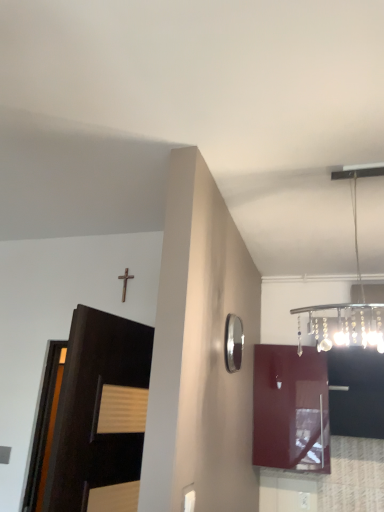
What is the approximate height of metallic chandelier at upper right?

The height of metallic chandelier at upper right is 75.75 centimeters.

You are a GUI agent. You are given a task and a screenshot of the screen. Output one action in this format:
    pyautogui.click(x=<x>, y=<y>)
    Task: Click on the metallic chandelier at upper right
    This screenshot has width=384, height=512.
    Given the screenshot: What is the action you would take?
    pyautogui.click(x=348, y=303)

Describe the element at coordinates (93, 410) in the screenshot. I see `dark wood door at left` at that location.

I want to click on dark wood door at left, so click(93, 410).

Where is `silver/metallic mirror at upper right`? This screenshot has height=512, width=384. silver/metallic mirror at upper right is located at coordinates (233, 343).

Locate an element on the screen. black glossy cabinet at upper right, marked as the first cabinetry in a right-to-left arrangement is located at coordinates (356, 392).

Find the location of a particular element. metallic chandelier at upper right is located at coordinates (348, 303).

Between metallic chandelier at upper right and black glossy cabinet at upper right, marked as the first cabinetry in a right-to-left arrangement, which one has less height?

Standing shorter between the two is black glossy cabinet at upper right, marked as the first cabinetry in a right-to-left arrangement.

From the image's perspective, is metallic chandelier at upper right over black glossy cabinet at upper right, marked as the second cabinetry in a left-to-right arrangement?

Yes, from the image's perspective, metallic chandelier at upper right is over black glossy cabinet at upper right, marked as the second cabinetry in a left-to-right arrangement.

Is metallic chandelier at upper right next to black glossy cabinet at upper right, marked as the second cabinetry in a left-to-right arrangement, and touching it?

No, metallic chandelier at upper right is not making contact with black glossy cabinet at upper right, marked as the second cabinetry in a left-to-right arrangement.

From a real-world perspective, which object stands above the other?

metallic chandelier at upper right.

Is glossy burgundy cabinet at right, which ranks as the 2th cabinetry in right-to-left order, positioned with its back to dark wood door at left?

glossy burgundy cabinet at right, which ranks as the 2th cabinetry in right-to-left order, is not turned away from dark wood door at left.

From the image's perspective, between glossy burgundy cabinet at right, the first cabinetry positioned from the left, and dark wood door at left, which one is located above?

dark wood door at left, from the image's perspective.

Can you tell me how much glossy burgundy cabinet at right, which ranks as the 2th cabinetry in right-to-left order, and dark wood door at left differ in facing direction?

glossy burgundy cabinet at right, which ranks as the 2th cabinetry in right-to-left order, and dark wood door at left are facing 100 degrees away from each other.

Is black glossy cabinet at upper right, marked as the second cabinetry in a left-to-right arrangement, surrounded by dark wood door at left?

No, black glossy cabinet at upper right, marked as the second cabinetry in a left-to-right arrangement, is located outside of dark wood door at left.

Considering the relative positions of dark wood door at left and black glossy cabinet at upper right, marked as the second cabinetry in a left-to-right arrangement, in the image provided, is dark wood door at left to the left of black glossy cabinet at upper right, marked as the second cabinetry in a left-to-right arrangement, from the viewer's perspective?

Yes, dark wood door at left is to the left of black glossy cabinet at upper right, marked as the second cabinetry in a left-to-right arrangement.

Are dark wood door at left and black glossy cabinet at upper right, marked as the second cabinetry in a left-to-right arrangement, located far from each other?

Yes.

From a real-world perspective, is dark wood door at left above or below black glossy cabinet at upper right, marked as the first cabinetry in a right-to-left arrangement?

In terms of real-world spatial position, dark wood door at left is below black glossy cabinet at upper right, marked as the first cabinetry in a right-to-left arrangement.

Would you say dark wood door at left is to the left or to the right of silver/metallic mirror at upper right in the picture?

dark wood door at left is to the left of silver/metallic mirror at upper right.

From the image's perspective, is dark wood door at left above silver/metallic mirror at upper right?

No, from the image's perspective, dark wood door at left is not on top of silver/metallic mirror at upper right.

Could silver/metallic mirror at upper right be considered to be inside dark wood door at left?

No, silver/metallic mirror at upper right is not inside dark wood door at left.

Is dark wood door at left with silver/metallic mirror at upper right?

They are not placed beside each other.

From a real-world perspective, relative to dark wood door at left, is silver/metallic mirror at upper right vertically above or below?

silver/metallic mirror at upper right is above dark wood door at left.

Which of these two, silver/metallic mirror at upper right or dark wood door at left, is smaller?

silver/metallic mirror at upper right is smaller.

Relative to dark wood door at left, is silver/metallic mirror at upper right in front or behind?

Visually, silver/metallic mirror at upper right is located behind dark wood door at left.

Visually, is black glossy cabinet at upper right, marked as the second cabinetry in a left-to-right arrangement, positioned to the left or to the right of glossy burgundy cabinet at right, which ranks as the 2th cabinetry in right-to-left order?

Clearly, black glossy cabinet at upper right, marked as the second cabinetry in a left-to-right arrangement, is on the right of glossy burgundy cabinet at right, which ranks as the 2th cabinetry in right-to-left order, in the image.

From a real-world perspective, is black glossy cabinet at upper right, marked as the second cabinetry in a left-to-right arrangement, on top of glossy burgundy cabinet at right, which ranks as the 2th cabinetry in right-to-left order?

Incorrect, from a real-world perspective, black glossy cabinet at upper right, marked as the second cabinetry in a left-to-right arrangement, is lower than glossy burgundy cabinet at right, which ranks as the 2th cabinetry in right-to-left order.

From the picture: Which of these two, black glossy cabinet at upper right, marked as the second cabinetry in a left-to-right arrangement, or glossy burgundy cabinet at right, the first cabinetry positioned from the left, stands taller?

glossy burgundy cabinet at right, the first cabinetry positioned from the left, is taller.

Between black glossy cabinet at upper right, marked as the first cabinetry in a right-to-left arrangement, and glossy burgundy cabinet at right, which ranks as the 2th cabinetry in right-to-left order, which one has larger width?

black glossy cabinet at upper right, marked as the first cabinetry in a right-to-left arrangement, is wider.

Who is bigger, metallic chandelier at upper right or glossy burgundy cabinet at right, the first cabinetry positioned from the left?

metallic chandelier at upper right.

Between metallic chandelier at upper right and glossy burgundy cabinet at right, which ranks as the 2th cabinetry in right-to-left order, which one appears on the left side from the viewer's perspective?

From the viewer's perspective, metallic chandelier at upper right appears more on the left side.

Does metallic chandelier at upper right turn towards glossy burgundy cabinet at right, the first cabinetry positioned from the left?

No, metallic chandelier at upper right does not turn towards glossy burgundy cabinet at right, the first cabinetry positioned from the left.

This screenshot has height=512, width=384. What are the coordinates of `light fixture above the glossy burgundy cabinet at right, the first cabinetry positioned from the left (from the image's perspective)` in the screenshot? It's located at (348, 303).

You are a GUI agent. You are given a task and a screenshot of the screen. Output one action in this format:
    pyautogui.click(x=<x>, y=<y>)
    Task: Click on the light fixture on the left side of black glossy cabinet at upper right, marked as the first cabinetry in a right-to-left arrangement
    The image size is (384, 512).
    Given the screenshot: What is the action you would take?
    pyautogui.click(x=348, y=303)

Starting from the dark wood door at left, which cabinetry is the 1st one to the right? Please provide its 2D coordinates.

[(290, 409)]

Which object lies nearer to the anchor point black glossy cabinet at upper right, marked as the second cabinetry in a left-to-right arrangement, dark wood door at left or glossy burgundy cabinet at right, which ranks as the 2th cabinetry in right-to-left order?

glossy burgundy cabinet at right, which ranks as the 2th cabinetry in right-to-left order, is closer to black glossy cabinet at upper right, marked as the second cabinetry in a left-to-right arrangement.

From the image, which object appears to be nearer to glossy burgundy cabinet at right, which ranks as the 2th cabinetry in right-to-left order, black glossy cabinet at upper right, marked as the first cabinetry in a right-to-left arrangement, or metallic chandelier at upper right?

black glossy cabinet at upper right, marked as the first cabinetry in a right-to-left arrangement, lies closer to glossy burgundy cabinet at right, which ranks as the 2th cabinetry in right-to-left order, than the other object.

When comparing their distances from black glossy cabinet at upper right, marked as the second cabinetry in a left-to-right arrangement, does silver/metallic mirror at upper right or glossy burgundy cabinet at right, which ranks as the 2th cabinetry in right-to-left order, seem further?

silver/metallic mirror at upper right is positioned further to the anchor black glossy cabinet at upper right, marked as the second cabinetry in a left-to-right arrangement.

Looking at the image, which one is located closer to black glossy cabinet at upper right, marked as the second cabinetry in a left-to-right arrangement, glossy burgundy cabinet at right, the first cabinetry positioned from the left, or metallic chandelier at upper right?

glossy burgundy cabinet at right, the first cabinetry positioned from the left.

Looking at the image, which one is located closer to dark wood door at left, black glossy cabinet at upper right, marked as the first cabinetry in a right-to-left arrangement, or glossy burgundy cabinet at right, which ranks as the 2th cabinetry in right-to-left order?

The object closer to dark wood door at left is glossy burgundy cabinet at right, which ranks as the 2th cabinetry in right-to-left order.

Looking at the image, which one is located closer to black glossy cabinet at upper right, marked as the first cabinetry in a right-to-left arrangement, dark wood door at left or metallic chandelier at upper right?

Among the two, metallic chandelier at upper right is located nearer to black glossy cabinet at upper right, marked as the first cabinetry in a right-to-left arrangement.

Consider the image. Looking at the image, which one is located closer to silver/metallic mirror at upper right, glossy burgundy cabinet at right, the first cabinetry positioned from the left, or dark wood door at left?

dark wood door at left lies closer to silver/metallic mirror at upper right than the other object.

Based on their spatial positions, is dark wood door at left or black glossy cabinet at upper right, marked as the first cabinetry in a right-to-left arrangement, further from metallic chandelier at upper right?

Among the two, dark wood door at left is located further to metallic chandelier at upper right.

Find the location of a particular element. The image size is (384, 512). cabinetry between dark wood door at left and glossy burgundy cabinet at right, the first cabinetry positioned from the left, along the z-axis is located at coordinates (356, 392).

Locate an element on the screen. This screenshot has width=384, height=512. light fixture between dark wood door at left and glossy burgundy cabinet at right, which ranks as the 2th cabinetry in right-to-left order, in the front-back direction is located at coordinates (348, 303).

Locate an element on the screen. This screenshot has width=384, height=512. mirror between dark wood door at left and glossy burgundy cabinet at right, the first cabinetry positioned from the left, along the z-axis is located at coordinates (233, 343).

Find the location of a particular element. This screenshot has width=384, height=512. cabinetry between metallic chandelier at upper right and glossy burgundy cabinet at right, which ranks as the 2th cabinetry in right-to-left order, along the z-axis is located at coordinates (356, 392).